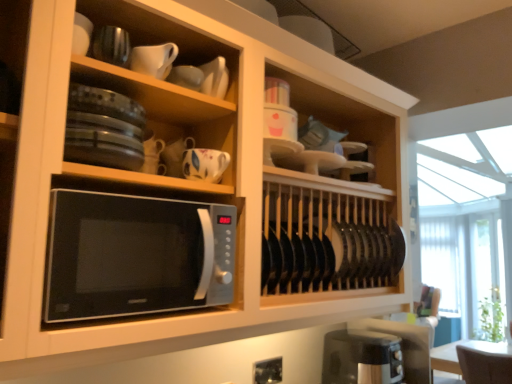
What do you see at coordinates (136, 255) in the screenshot? This screenshot has width=512, height=384. I see `sleek silver microwave at center` at bounding box center [136, 255].

What do you see at coordinates (154, 59) in the screenshot?
I see `white matte pitcher at upper center, which ranks as the 4th tableware in bottom-to-top order` at bounding box center [154, 59].

What do you see at coordinates (205, 164) in the screenshot?
I see `glossy ceramic mug at upper center, which is counted as the fourth tableware, starting from the top` at bounding box center [205, 164].

What is the approximate width of matte white cup at upper center, the third tableware from the top?

→ matte white cup at upper center, the third tableware from the top, is 2.45 inches wide.

Image resolution: width=512 pixels, height=384 pixels. Describe the element at coordinates (186, 77) in the screenshot. I see `matte white cup at upper center, which is counted as the second tableware, starting from the bottom` at that location.

You are a GUI agent. You are given a task and a screenshot of the screen. Output one action in this format:
    pyautogui.click(x=<x>, y=<y>)
    Task: Click on the sleek silver microwave at center
    
    Given the screenshot: What is the action you would take?
    pyautogui.click(x=136, y=255)

Based on their positions, is sleek silver microwave at center located to the left or right of black plastic toaster at lower right?

sleek silver microwave at center is positioned on black plastic toaster at lower right's left side.

Is sleek silver microwave at center positioned beyond the bounds of black plastic toaster at lower right?

That's correct, sleek silver microwave at center is outside of black plastic toaster at lower right.

Is sleek silver microwave at center directly adjacent to black plastic toaster at lower right?

They are not placed beside each other.

Which is in front, sleek silver microwave at center or black plastic toaster at lower right?

sleek silver microwave at center is closer to the camera.

Based on the photo, how far apart are black plastic toaster at lower right and glossy ceramic mug at upper center, which is counted as the first tableware, starting from the bottom?

They are 34.69 inches apart.

Considering the positions of objects black plastic toaster at lower right and glossy ceramic mug at upper center, which is counted as the fourth tableware, starting from the top, in the image provided, who is more to the left, black plastic toaster at lower right or glossy ceramic mug at upper center, which is counted as the fourth tableware, starting from the top,?

glossy ceramic mug at upper center, which is counted as the fourth tableware, starting from the top.

Is black plastic toaster at lower right not close to glossy ceramic mug at upper center, which is counted as the fourth tableware, starting from the top?

black plastic toaster at lower right is near glossy ceramic mug at upper center, which is counted as the fourth tableware, starting from the top, not far away.

At what (x,y) coordinates should I click in order to perform the action: click on the 2nd tableware counting from the left of the black plastic toaster at lower right. Please return your answer as a coordinate pair (x, y). This screenshot has width=512, height=384. Looking at the image, I should click on (205, 164).

The width and height of the screenshot is (512, 384). I want to click on appliance that is under the glossy ceramic mug at upper center, which is counted as the fourth tableware, starting from the top (from a real-world perspective), so click(x=361, y=357).

Is glossy ceramic mug at upper center, which is counted as the first tableware, starting from the bottom, turned away from black plastic toaster at lower right?

glossy ceramic mug at upper center, which is counted as the first tableware, starting from the bottom, does not have its back to black plastic toaster at lower right.

From the image's perspective, which one is positioned lower, glossy ceramic mug at upper center, which is counted as the first tableware, starting from the bottom, or black plastic toaster at lower right?

black plastic toaster at lower right, from the image's perspective.

Measure the distance between glossy ceramic mug at upper center, which is counted as the fourth tableware, starting from the top, and black plastic toaster at lower right.

glossy ceramic mug at upper center, which is counted as the fourth tableware, starting from the top, and black plastic toaster at lower right are 34.69 inches apart from each other.

Who is more distant, white matte pitcher at upper center, which is counted as the 1th tableware, starting from the top, or matte white cup at upper center, the third tableware from the top?

matte white cup at upper center, the third tableware from the top.

Is white matte pitcher at upper center, which ranks as the 4th tableware in bottom-to-top order, taller than matte white cup at upper center, the third tableware from the top?

Indeed, white matte pitcher at upper center, which ranks as the 4th tableware in bottom-to-top order, has a greater height compared to matte white cup at upper center, the third tableware from the top.

Considering the positions of points (135, 51) and (193, 72), is point (135, 51) farther from camera compared to point (193, 72)?

No, it is in front of (193, 72).

Looking at this image, how different are the orientations of sleek silver microwave at center and white matte pitcher at upper center, which is counted as the 1th tableware, starting from the top, in degrees?

The facing directions of sleek silver microwave at center and white matte pitcher at upper center, which is counted as the 1th tableware, starting from the top, are 3.16 degrees apart.

Which of these two, sleek silver microwave at center or white matte pitcher at upper center, which is counted as the 1th tableware, starting from the top, stands shorter?

white matte pitcher at upper center, which is counted as the 1th tableware, starting from the top, is shorter.

From a real-world perspective, is sleek silver microwave at center located higher than white matte pitcher at upper center, which ranks as the 4th tableware in bottom-to-top order?

No, from a real-world perspective, sleek silver microwave at center is not over white matte pitcher at upper center, which ranks as the 4th tableware in bottom-to-top order

From the image's perspective, which one is positioned higher, sleek silver microwave at center or white matte pitcher at upper center, which ranks as the 4th tableware in bottom-to-top order?

white matte pitcher at upper center, which ranks as the 4th tableware in bottom-to-top order.

Could you tell me if white matte pitcher at upper center, which is counted as the 1th tableware, starting from the top, is facing black plastic toaster at lower right?

No, white matte pitcher at upper center, which is counted as the 1th tableware, starting from the top, is not aimed at black plastic toaster at lower right.

Between white matte pitcher at upper center, which ranks as the 4th tableware in bottom-to-top order, and black plastic toaster at lower right, which one has larger size?

black plastic toaster at lower right.

Is white matte pitcher at upper center, which is counted as the 1th tableware, starting from the top, located outside black plastic toaster at lower right?

white matte pitcher at upper center, which is counted as the 1th tableware, starting from the top, lies outside black plastic toaster at lower right's area.

Which is more distant, [142,51] or [322,373]?

The point [322,373] is farther.

Between matte white cup at upper center, the third tableware from the top, and glossy ceramic mug at upper center, which is counted as the first tableware, starting from the bottom, which one has more height?

Standing taller between the two is glossy ceramic mug at upper center, which is counted as the first tableware, starting from the bottom.

Considering the relative positions of matte white cup at upper center, the third tableware from the top, and glossy ceramic mug at upper center, which is counted as the first tableware, starting from the bottom, in the image provided, is matte white cup at upper center, the third tableware from the top, behind glossy ceramic mug at upper center, which is counted as the first tableware, starting from the bottom,?

No.

Which of these two, matte white cup at upper center, which is counted as the second tableware, starting from the bottom, or glossy ceramic mug at upper center, which is counted as the fourth tableware, starting from the top, is bigger?

Bigger between the two is glossy ceramic mug at upper center, which is counted as the fourth tableware, starting from the top.

Find the location of a particular element. This screenshot has height=384, width=512. tableware that appears below the matte white cup at upper center, which is counted as the second tableware, starting from the bottom (from a real-world perspective) is located at coordinates (205, 164).

Where is `appliance lying behind the sleek silver microwave at center`? This screenshot has height=384, width=512. appliance lying behind the sleek silver microwave at center is located at coordinates (361, 357).

Image resolution: width=512 pixels, height=384 pixels. Identify the location of appliance below the glossy ceramic mug at upper center, which is counted as the fourth tableware, starting from the top (from a real-world perspective). (361, 357).

Considering their positions, is black plastic toaster at lower right positioned closer to matte white cup at upper center, which is counted as the second tableware, starting from the bottom, than white matte pitcher at upper center, which ranks as the 4th tableware in bottom-to-top order?

white matte pitcher at upper center, which ranks as the 4th tableware in bottom-to-top order, lies closer to matte white cup at upper center, which is counted as the second tableware, starting from the bottom, than the other object.

Considering their positions, is white matte pitcher at upper center, which is counted as the 1th tableware, starting from the top, positioned closer to white glossy cup at upper center, the 2th tableware from the top, than matte white cup at upper center, the third tableware from the top?

matte white cup at upper center, the third tableware from the top, lies closer to white glossy cup at upper center, the 2th tableware from the top, than the other object.

From the image, which object appears to be farther from sleek silver microwave at center, black plastic toaster at lower right or white matte pitcher at upper center, which ranks as the 4th tableware in bottom-to-top order?

black plastic toaster at lower right lies further to sleek silver microwave at center than the other object.

Based on the photo, estimate the real-world distances between objects in this image. Which object is closer to white glossy cup at upper center, marked as the third tableware in a bottom-to-top arrangement, matte white cup at upper center, the third tableware from the top, or glossy ceramic mug at upper center, which is counted as the fourth tableware, starting from the top?

Based on the image, matte white cup at upper center, the third tableware from the top, appears to be nearer to white glossy cup at upper center, marked as the third tableware in a bottom-to-top arrangement.

From the picture: Estimate the real-world distances between objects in this image. Which object is further from sleek silver microwave at center, glossy ceramic mug at upper center, which is counted as the first tableware, starting from the bottom, or black plastic toaster at lower right?

black plastic toaster at lower right is positioned further to the anchor sleek silver microwave at center.

Estimate the real-world distances between objects in this image. Which object is closer to glossy ceramic mug at upper center, which is counted as the fourth tableware, starting from the top, sleek silver microwave at center or matte white cup at upper center, which is counted as the second tableware, starting from the bottom?

Among the two, matte white cup at upper center, which is counted as the second tableware, starting from the bottom, is located nearer to glossy ceramic mug at upper center, which is counted as the fourth tableware, starting from the top.

Looking at the image, which one is located further to white glossy cup at upper center, marked as the third tableware in a bottom-to-top arrangement, white matte pitcher at upper center, which ranks as the 4th tableware in bottom-to-top order, or glossy ceramic mug at upper center, which is counted as the first tableware, starting from the bottom?

glossy ceramic mug at upper center, which is counted as the first tableware, starting from the bottom.

Based on their spatial positions, is white glossy cup at upper center, marked as the third tableware in a bottom-to-top arrangement, or sleek silver microwave at center closer to black plastic toaster at lower right?

sleek silver microwave at center.

Locate an element on the screen. tableware between matte white cup at upper center, the third tableware from the top, and sleek silver microwave at center from top to bottom is located at coordinates (205, 164).

Locate an element on the screen. This screenshot has height=384, width=512. microwave oven between white matte pitcher at upper center, which is counted as the 1th tableware, starting from the top, and black plastic toaster at lower right, in the vertical direction is located at coordinates (136, 255).

Where is `microwave oven between white glossy cup at upper center, the 2th tableware from the top, and black plastic toaster at lower right vertically`? microwave oven between white glossy cup at upper center, the 2th tableware from the top, and black plastic toaster at lower right vertically is located at coordinates (136, 255).

Where is `tableware that lies between matte white cup at upper center, the third tableware from the top, and black plastic toaster at lower right from top to bottom`? Image resolution: width=512 pixels, height=384 pixels. tableware that lies between matte white cup at upper center, the third tableware from the top, and black plastic toaster at lower right from top to bottom is located at coordinates (205, 164).